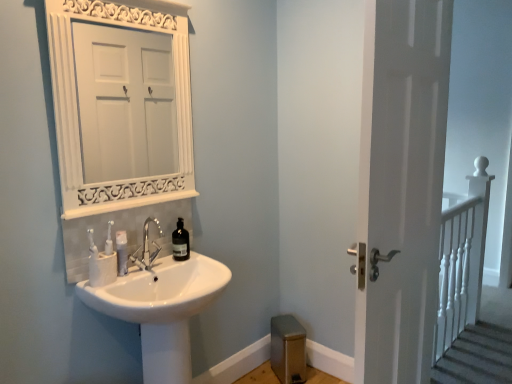
Question: Considering the relative sizes of white matte toothpaste tube at sink and polished chrome faucet at sink center in the image provided, is white matte toothpaste tube at sink bigger than polished chrome faucet at sink center?

Choices:
 (A) yes
 (B) no

Answer: (B)

Question: Is white matte toothpaste tube at sink oriented towards polished chrome faucet at sink center?

Choices:
 (A) no
 (B) yes

Answer: (A)

Question: Are white matte toothpaste tube at sink and polished chrome faucet at sink center making contact?

Choices:
 (A) yes
 (B) no

Answer: (B)

Question: From a real-world perspective, does white matte toothpaste tube at sink stand above polished chrome faucet at sink center?

Choices:
 (A) yes
 (B) no

Answer: (B)

Question: Considering the relative sizes of white matte toothpaste tube at sink and polished chrome faucet at sink center in the image provided, is white matte toothpaste tube at sink taller than polished chrome faucet at sink center?

Choices:
 (A) yes
 (B) no

Answer: (B)

Question: From the image's perspective, is white matte toothpaste tube at sink positioned above or below white glossy sink at lower left?

Choices:
 (A) below
 (B) above

Answer: (B)

Question: Does point (125, 268) appear closer or farther from the camera than point (186, 347)?

Choices:
 (A) closer
 (B) farther

Answer: (A)

Question: In terms of width, does white matte toothpaste tube at sink look wider or thinner when compared to white glossy sink at lower left?

Choices:
 (A) thin
 (B) wide

Answer: (A)

Question: Based on their positions, is white matte toothpaste tube at sink located to the left or right of white glossy sink at lower left?

Choices:
 (A) right
 (B) left

Answer: (B)

Question: In terms of height, does white matte door at right look taller or shorter compared to white wooden railing at right?

Choices:
 (A) short
 (B) tall

Answer: (B)

Question: Is white matte door at right wider or thinner than white wooden railing at right?

Choices:
 (A) wide
 (B) thin

Answer: (B)

Question: In the image, is white matte door at right positioned in front of or behind white wooden railing at right?

Choices:
 (A) front
 (B) behind

Answer: (A)

Question: From a real-world perspective, relative to white wooden railing at right, is white matte door at right vertically above or below?

Choices:
 (A) below
 (B) above

Answer: (B)

Question: Considering the positions of white matte door at right and white glossy sink at lower left in the image, is white matte door at right taller or shorter than white glossy sink at lower left?

Choices:
 (A) short
 (B) tall

Answer: (B)

Question: In the image, is white matte door at right positioned in front of or behind white glossy sink at lower left?

Choices:
 (A) behind
 (B) front

Answer: (B)